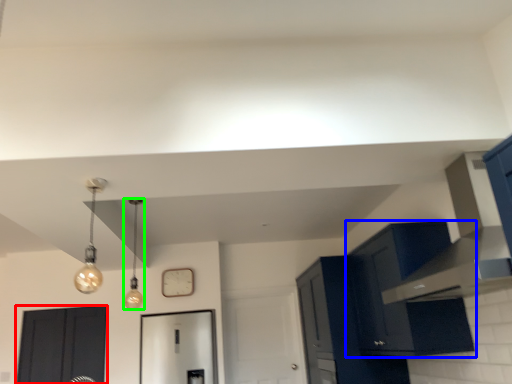
Question: Which object is positioned closest to door (highlighted by a red box)? Select from cabinetry (highlighted by a blue box) and light fixture (highlighted by a green box).

Choices:
 (A) cabinetry
 (B) light fixture

Answer: (B)